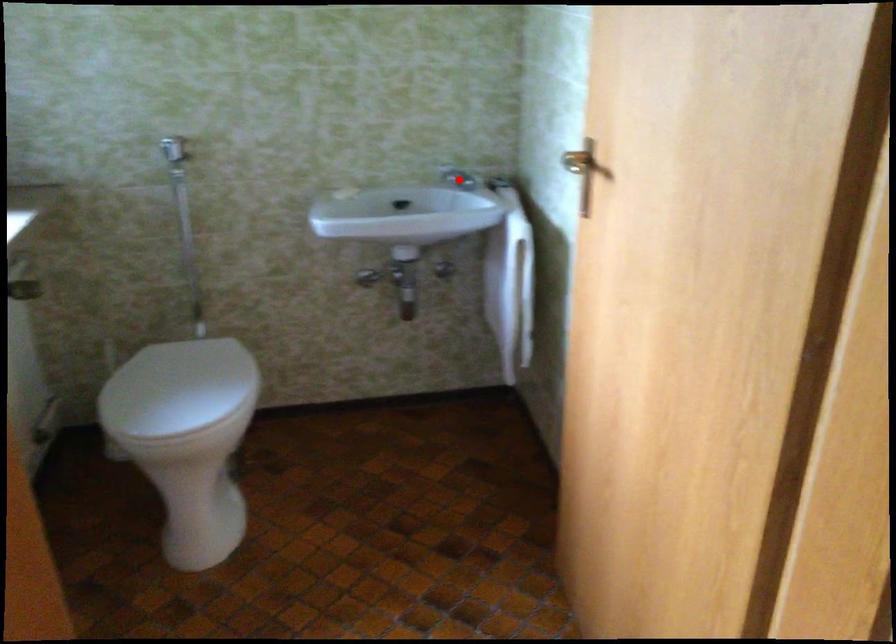
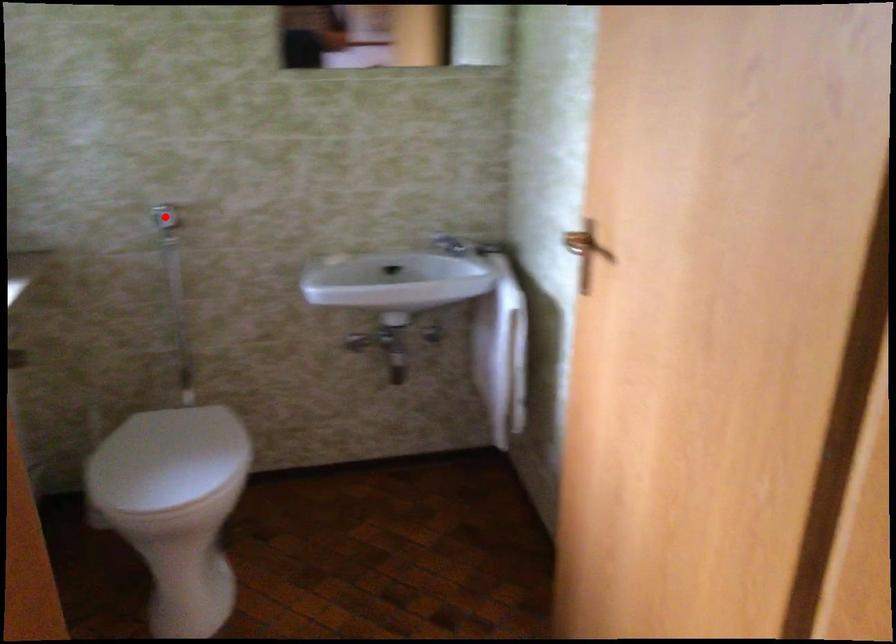
I am providing you with two images of the same scene from different viewpoints. A red point is marked on the first image and another point is marked on the second image. Do the highlighted points in image1 and image2 indicate the same real-world spot?

No